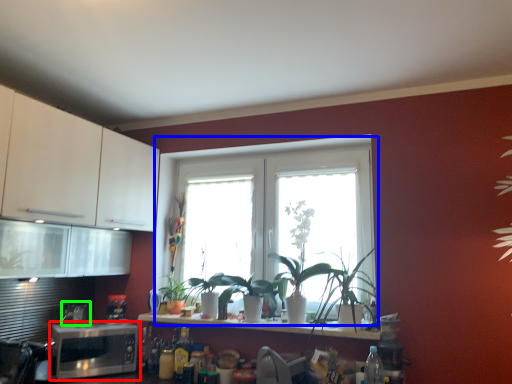
Question: Considering the real-world distances, which object is farthest from microwave oven (highlighted by a red box)? window (highlighted by a blue box) or appliance (highlighted by a green box)?

Choices:
 (A) window
 (B) appliance

Answer: (A)